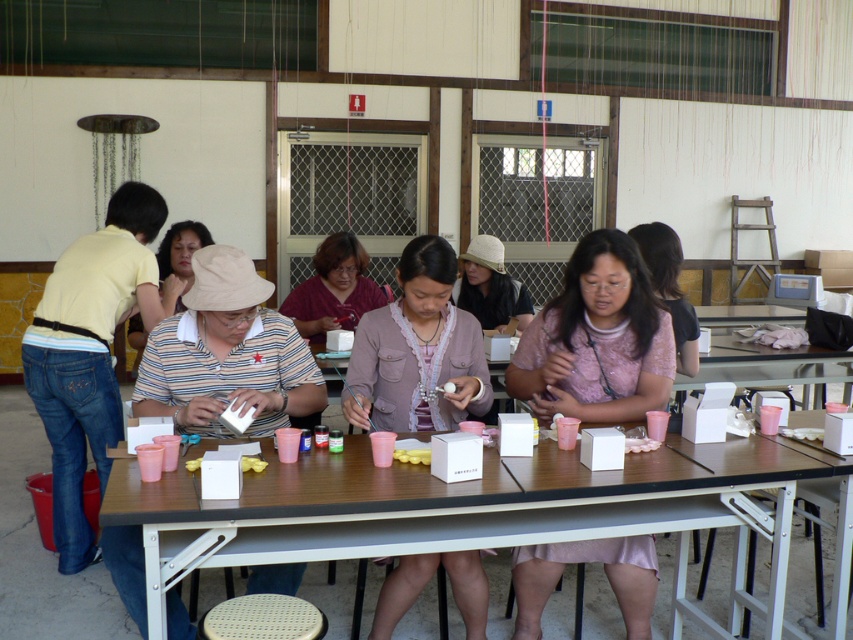
The height and width of the screenshot is (640, 853). What do you see at coordinates (596, 339) in the screenshot?
I see `pink satin dress at center` at bounding box center [596, 339].

Which is in front, point (646, 337) or point (422, 321)?

Point (422, 321)

The image size is (853, 640). Identify the location of pink satin dress at center. (596, 339).

Which is below, white woven stool at lower center or matte white hat at center?

Positioned lower is white woven stool at lower center.

Is white woven stool at lower center wider than matte white hat at center?

No.

Between point (285, 609) and point (134, 346), which one is positioned in front?

Point (285, 609)

The width and height of the screenshot is (853, 640). In order to click on white woven stool at lower center in this screenshot , I will do `click(263, 618)`.

From the picture: Does matte white hat at center appear over yellow matte sponge at table center?

Yes.

Which of these two, matte white hat at center or yellow matte sponge at table center, stands shorter?

Standing shorter between the two is yellow matte sponge at table center.

Identify the location of matte white hat at center. (178, 259).

The width and height of the screenshot is (853, 640). Identify the location of matte white hat at center. (178, 259).